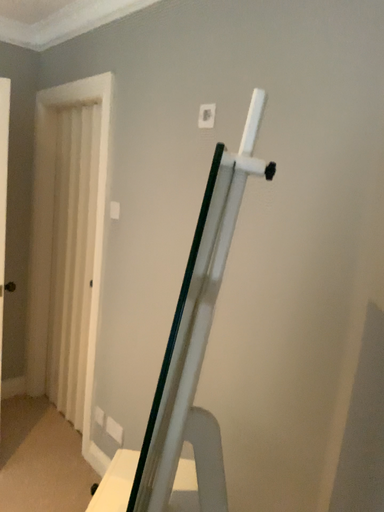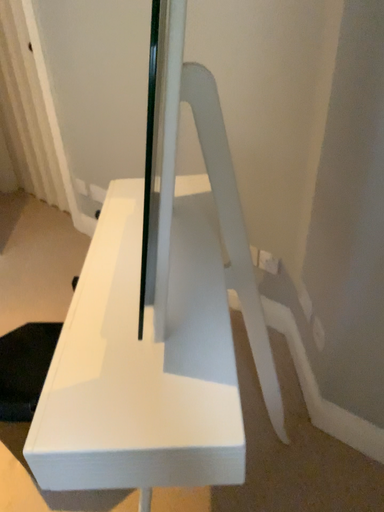
Question: Which way did the camera rotate in the video?

Choices:
 (A) rotated left
 (B) rotated right

Answer: (B)